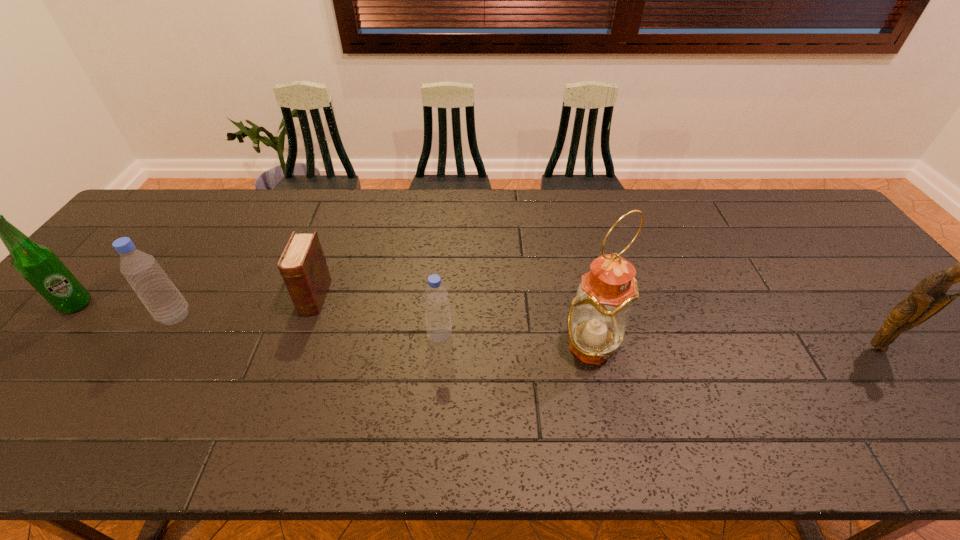
At what (x,y) coordinates should I click in order to perform the action: click on free spot located on the right of the left bottle. Please return your answer as a coordinate pair (x, y). This screenshot has width=960, height=540. Looking at the image, I should click on (300, 316).

Where is `vacant space situated on the back of the shorter bottle`? The height and width of the screenshot is (540, 960). vacant space situated on the back of the shorter bottle is located at coordinates (446, 252).

Identify the location of free space located 0.190m on the spine side of the fourth object from right to left. This screenshot has height=540, width=960. (284, 383).

Find the location of a particular element. The width and height of the screenshot is (960, 540). vacant space located on the label of the leftmost object is located at coordinates (217, 305).

I want to click on free point located on the front-facing side of the figurine, so click(x=921, y=404).

Where is `free spot located on the left of the tallest object`? This screenshot has width=960, height=540. free spot located on the left of the tallest object is located at coordinates coord(442,346).

What are the coordinates of `object located in the left edge section of the desktop` in the screenshot? It's located at (38, 264).

Locate an element on the screen. The image size is (960, 540). object present at the right edge is located at coordinates (929, 297).

I want to click on vacant space at the far edge, so click(410, 231).

In the image, there is a desktop. Where is `vacant space at the near edge`? Image resolution: width=960 pixels, height=540 pixels. vacant space at the near edge is located at coordinates (308, 390).